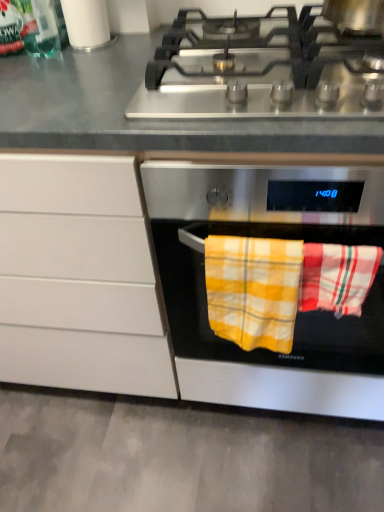
Where is `vacant region above white matte cabinet at center (from a real-world perspective)`? This screenshot has height=512, width=384. vacant region above white matte cabinet at center (from a real-world perspective) is located at coordinates (67, 65).